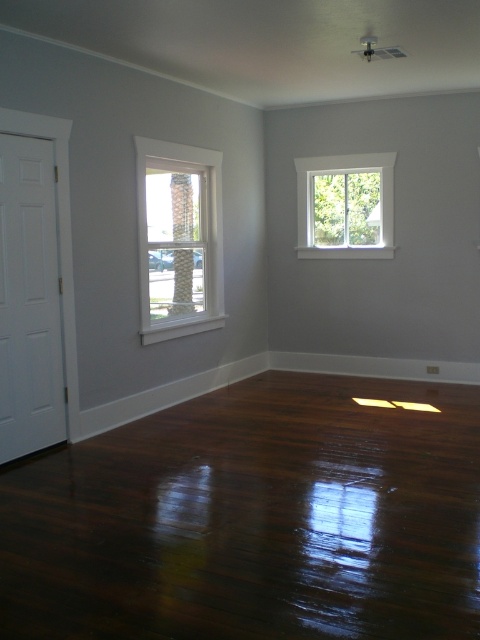
Question: Does shiny dark wood floor at lower center appear over white wood window at left?

Choices:
 (A) yes
 (B) no

Answer: (B)

Question: Which point appears farthest from the camera in this image?

Choices:
 (A) (178, 225)
 (B) (259, 458)

Answer: (A)

Question: Is shiny dark wood floor at lower center positioned at the back of white wood window at left?

Choices:
 (A) no
 (B) yes

Answer: (A)

Question: Based on their relative distances, which object is farther from the shiny dark wood floor at lower center?

Choices:
 (A) white wood window at left
 (B) white glass window at upper right

Answer: (B)

Question: Can you confirm if white wood window at left is positioned above white glass window at upper right?

Choices:
 (A) no
 (B) yes

Answer: (A)

Question: Which point is farther from the camera taking this photo?

Choices:
 (A) [156, 241]
 (B) [392, 170]

Answer: (B)